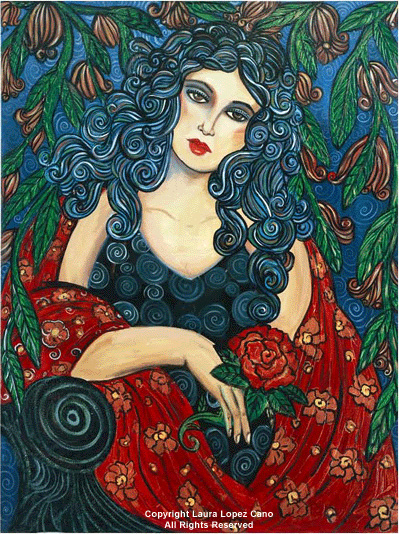
Find the location of `red drape`. red drape is located at coordinates (158, 454).